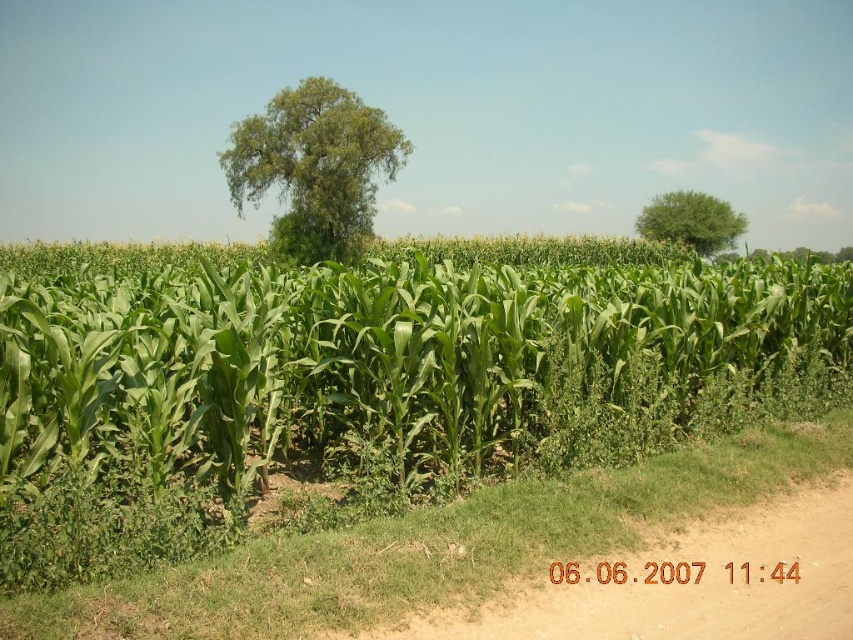
You are a farmer checking the growth of your crops. You have two plants to compare in the image, the green leafy corn at center and the green leafy tree at upper right. Which plant is larger in size?

The green leafy corn at center is bigger than the green leafy tree at upper right.

You are a farmer checking the health of your crops. You notice the green leafy corn at center and the brown dirt track at lower right. Which object is bigger in size?

The green leafy corn at center is larger in size compared to the brown dirt track at lower right according to the description.

You are a farmer standing at the edge of the cornfield. You need to walk towards the green leafy tree at center. Which direction should you walk relative to the green leafy corn at center?

The green leafy corn at center is to the right of the green leafy tree at center, so to reach the tree, you should walk to the left of the green leafy corn at center.